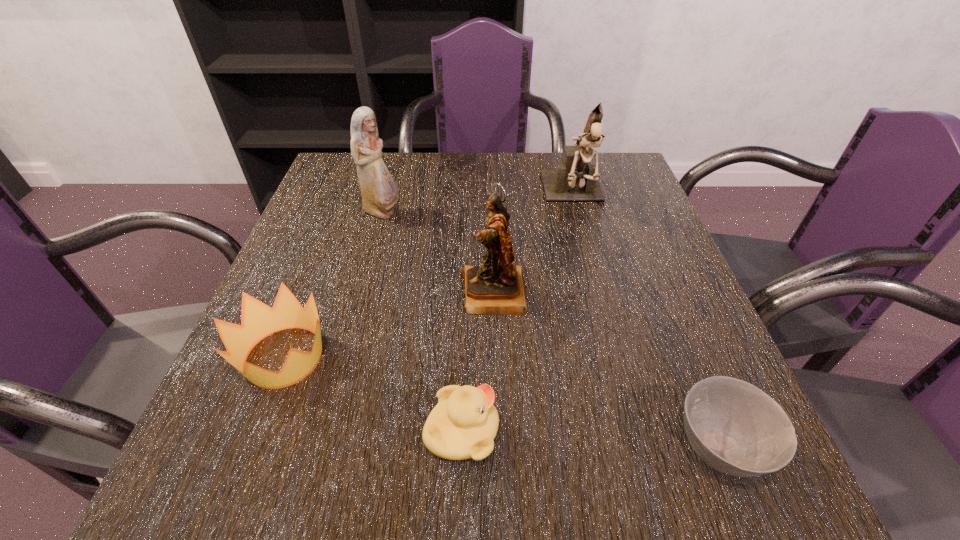
I want to click on blank space located on the front-facing side of the nearest figurine, so click(345, 293).

Find the location of a particular element. The image size is (960, 540). vacant space located 0.370m on the beak of the duckling is located at coordinates (742, 431).

The height and width of the screenshot is (540, 960). In order to click on free spot located on the left of the bowl in this screenshot , I will do `click(434, 448)`.

Locate an element on the screen. The width and height of the screenshot is (960, 540). object at the far edge is located at coordinates (574, 180).

Where is `duckling that is at the near edge`? duckling that is at the near edge is located at coordinates (463, 425).

Find the location of `bowl that is positioned at the near edge`. bowl that is positioned at the near edge is located at coordinates (734, 427).

Locate an element on the screen. The image size is (960, 540). figurine that is at the left edge is located at coordinates tap(379, 192).

Locate an element on the screen. The width and height of the screenshot is (960, 540). crown that is at the left edge is located at coordinates (258, 320).

Locate an element on the screen. figurine located at the right edge is located at coordinates (574, 180).

Locate an element on the screen. bowl that is at the right edge is located at coordinates (734, 427).